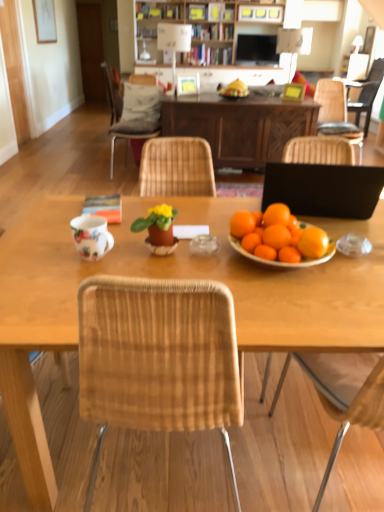
Locate an element on the screen. The image size is (384, 512). vacant point to the left of matte clay pot at center is located at coordinates (112, 250).